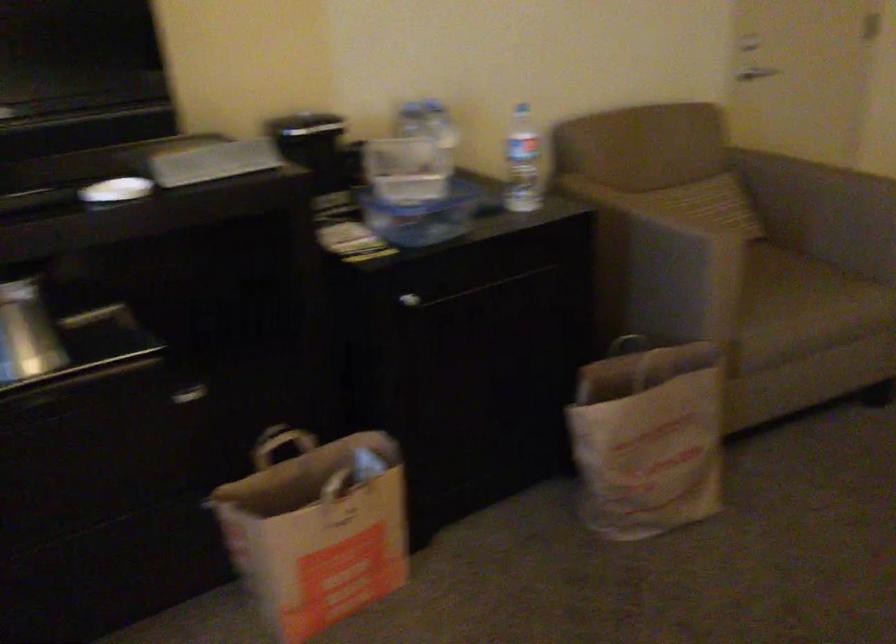
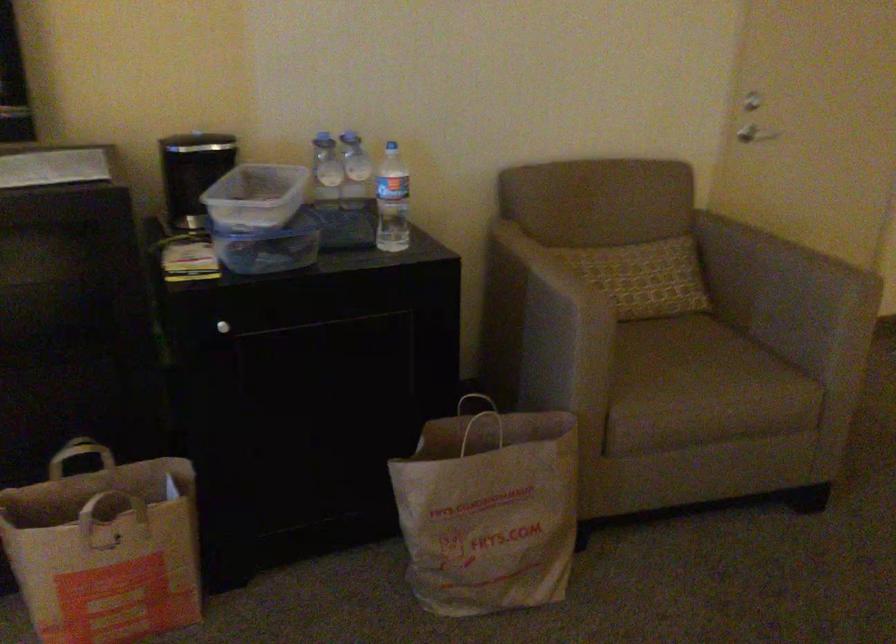
The point at (446, 138) is marked in the first image. Where is the corresponding point in the second image?

(355, 171)